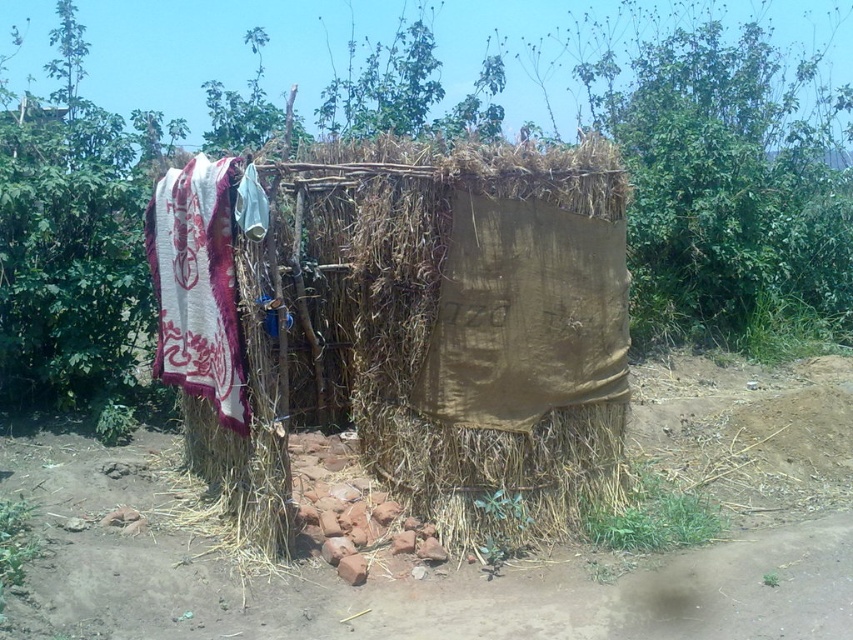
You are a delivery person who needs to place a box that is 3 feet wide between the burlap cloth at center and the white woven cloth at left. Can you fit the box between them without moving either cloth?

The distance between the burlap cloth at center and the white woven cloth at left is 36.83 inches. Since the box is 3 feet wide, which is 36 inches, there is only 0.83 inches of extra space. This is insufficient for safe placement, so the box cannot fit comfortably between them.

You are an observer standing in front of the rustic shelter. You notice two items hanging on its walls. The brown fabric at center and the white woven cloth at left. Which one is located to the right of the other?

The brown fabric at center is positioned on the right side of white woven cloth at left.

You are organizing a camping trip and need to cover two items with the cloths available. The burlap cloth at center and the white woven cloth at left are your options. Which cloth should you choose to cover a larger item?

The burlap cloth at center is larger in size than the white woven cloth at left, so you should choose the burlap cloth at center to cover a larger item.